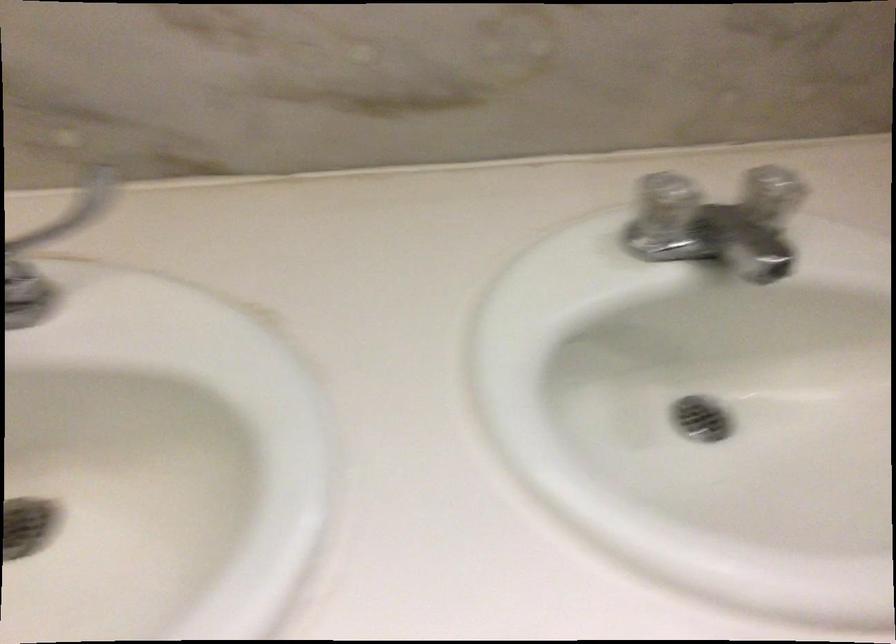
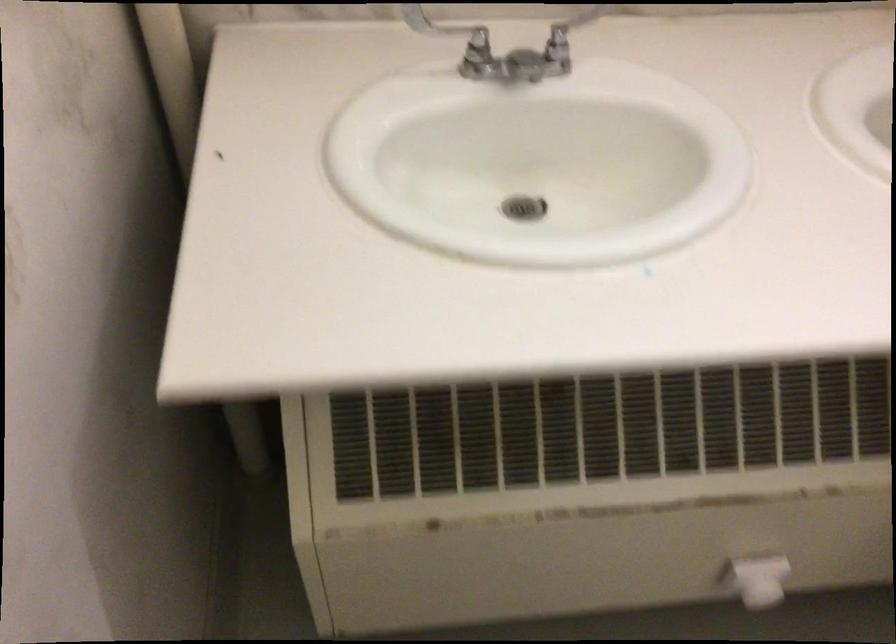
In the second image, find the point that corresponds to pixel 110 205 in the first image.

(558, 33)